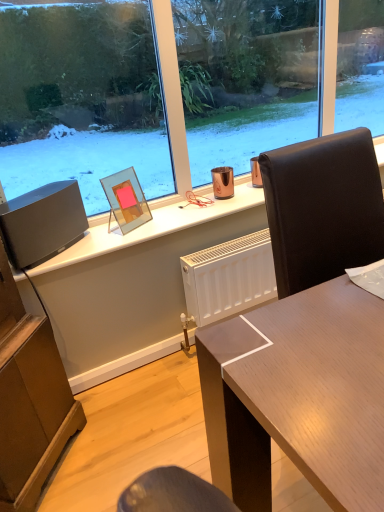
Question: In the image, is matte black speaker at left on the left side or the right side of transparent glass picture frame at upper center?

Choices:
 (A) left
 (B) right

Answer: (A)

Question: Is matte black speaker at left wider or thinner than transparent glass picture frame at upper center?

Choices:
 (A) wide
 (B) thin

Answer: (A)

Question: Relative to transparent glass picture frame at upper center, is matte black speaker at left in front or behind?

Choices:
 (A) front
 (B) behind

Answer: (A)

Question: Considering the positions of point (122, 208) and point (34, 241), is point (122, 208) closer or farther from the camera than point (34, 241)?

Choices:
 (A) farther
 (B) closer

Answer: (A)

Question: Considering their positions, is transparent glass picture frame at upper center located in front of or behind matte black speaker at left?

Choices:
 (A) front
 (B) behind

Answer: (B)

Question: In terms of width, does transparent glass picture frame at upper center look wider or thinner when compared to matte black speaker at left?

Choices:
 (A) thin
 (B) wide

Answer: (A)

Question: Would you say transparent glass picture frame at upper center is inside or outside matte black speaker at left?

Choices:
 (A) inside
 (B) outside

Answer: (B)